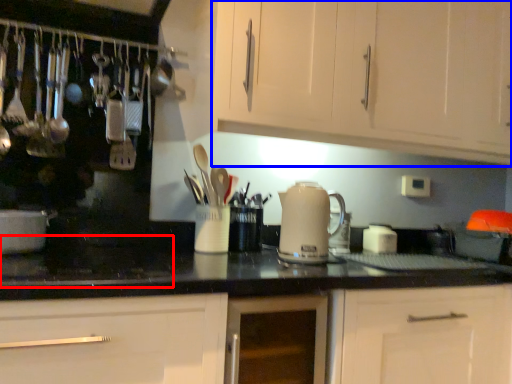
Question: Among these objects, which one is nearest to the camera, gas stove (highlighted by a red box) or cabinetry (highlighted by a blue box)?

Choices:
 (A) gas stove
 (B) cabinetry

Answer: (A)